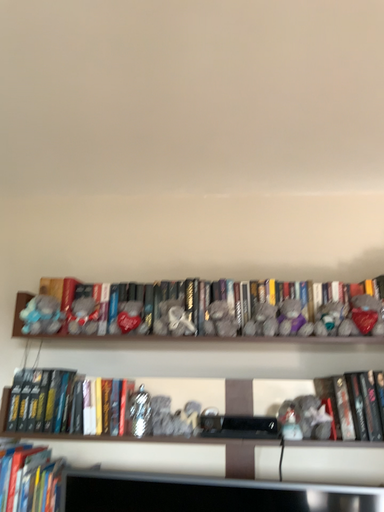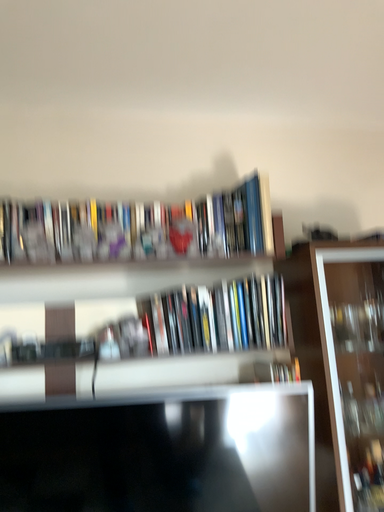
Question: How did the camera likely rotate when shooting the video?

Choices:
 (A) rotated left
 (B) rotated right

Answer: (B)